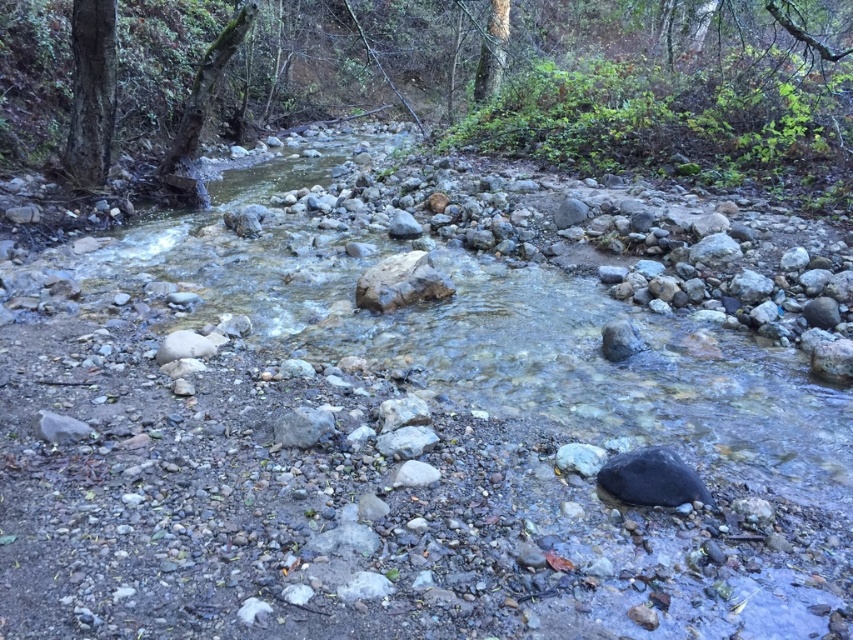
You are a hiker who wants to cross the stream by stepping on the smooth gray rock at center and the green mossy tree trunk at upper left. Which one is a better choice for a stable footing?

The smooth gray rock at center is smaller than the green mossy tree trunk at upper left, so the green mossy tree trunk at upper left provides a larger and more stable surface for crossing the stream.

You are standing at the edge of the stream and want to reach the smooth bark tree at upper left. The stream is 21.59 feet wide. Can you cross it safely if you can only jump 10 feet?

The distance between you and the smooth bark tree at upper left is 21.59 feet. Since you can only jump 10 feet, you cannot cross the stream safely in a single jump. You may need to find a narrower part of the stream or use stepping stones if available.